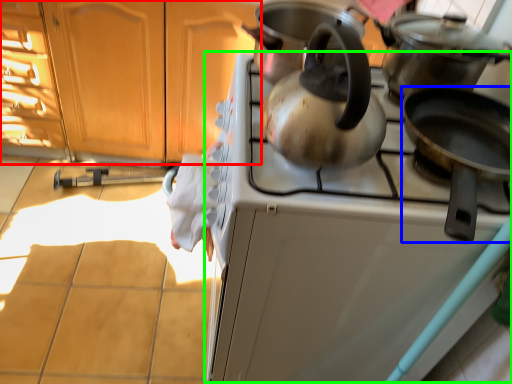
Question: Which object is the farthest from cabinetry (highlighted by a red box)? Choose among these: kitchen appliance (highlighted by a blue box) or oven (highlighted by a green box).

Choices:
 (A) kitchen appliance
 (B) oven

Answer: (A)